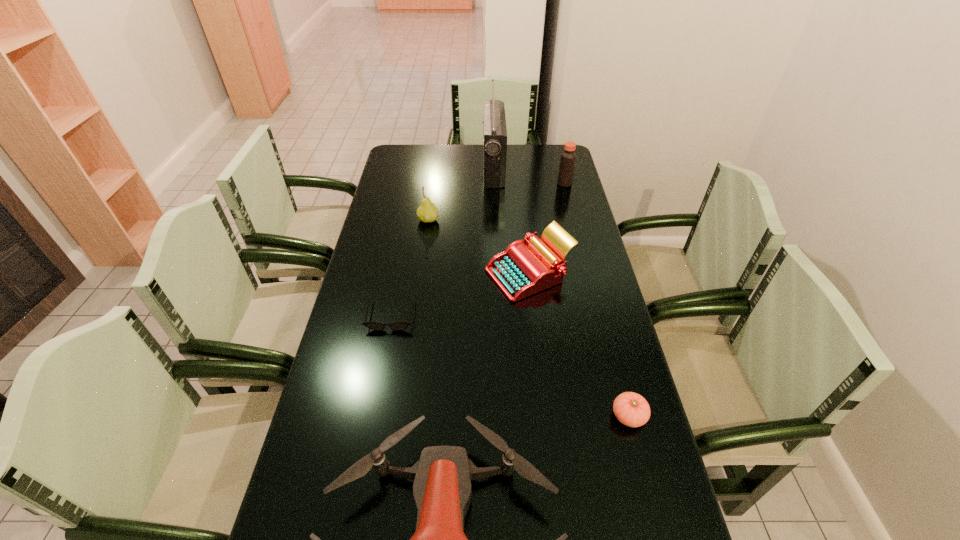
In order to click on unoccupied position between the sunglasses and the second tallest object in this screenshot , I will do `click(478, 249)`.

Identify the location of object identified as the closest to the typewriter. This screenshot has width=960, height=540. (397, 326).

Find the location of a particular element. The image size is (960, 540). the fourth closest object to the radio receiver is located at coordinates (397, 326).

At what (x,y) coordinates should I click in order to perform the action: click on free region that satisfies the following two spatial constraints: 1. on the front-facing side of the tomato; 2. on the left side of the shortest object. Please return your answer as a coordinate pair (x, y). This screenshot has height=540, width=960. Looking at the image, I should click on (372, 416).

Locate an element on the screen. The width and height of the screenshot is (960, 540). vacant space that satisfies the following two spatial constraints: 1. on the back side of the second shortest object; 2. on the front-facing side of the radio receiver is located at coordinates (564, 168).

Identify the location of free location that satisfies the following two spatial constraints: 1. on the typing side of the sixth farthest object; 2. on the left side of the typewriter. (545, 416).

This screenshot has height=540, width=960. I want to click on vacant space that satisfies the following two spatial constraints: 1. on the front-facing side of the tallest object; 2. on the back side of the vinegar, so click(x=494, y=184).